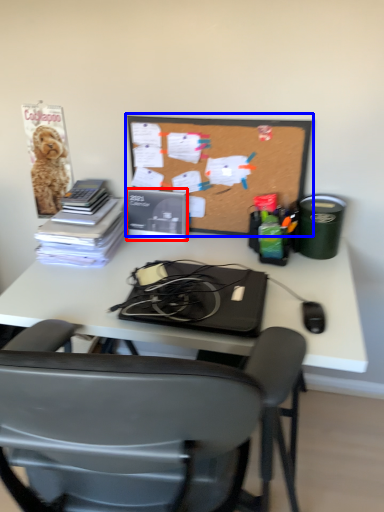
Question: Which object is further to the camera taking this photo, paperback book (highlighted by a red box) or bulletin board (highlighted by a blue box)?

Choices:
 (A) paperback book
 (B) bulletin board

Answer: (A)